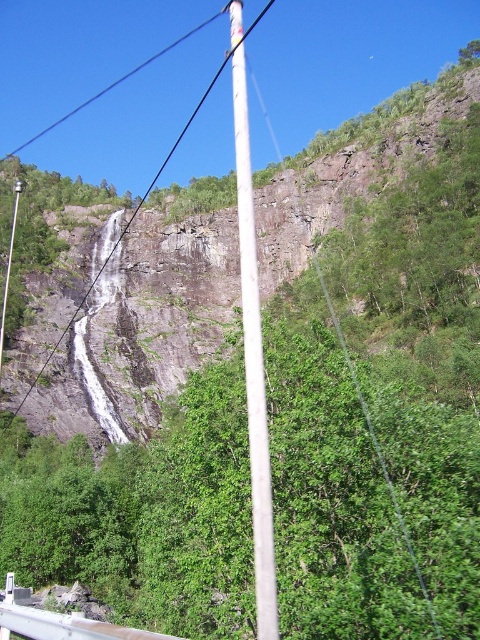
Question: Among these points, which one is farthest from the camera?

Choices:
 (A) (257, 490)
 (B) (8, 422)

Answer: (B)

Question: From the image, what is the correct spatial relationship of white smooth pole at center in relation to white plastic pole at center?

Choices:
 (A) above
 (B) below

Answer: (A)

Question: Can you confirm if white smooth pole at center is positioned to the right of white plastic pole at center?

Choices:
 (A) yes
 (B) no

Answer: (A)

Question: Is white smooth pole at center positioned behind white plastic pole at center?

Choices:
 (A) no
 (B) yes

Answer: (A)

Question: Which point is closer to the camera?

Choices:
 (A) (31, 388)
 (B) (244, 84)

Answer: (A)

Question: Which object appears farthest from the camera in this image?

Choices:
 (A) white smooth pole at center
 (B) white plastic pole at center

Answer: (B)